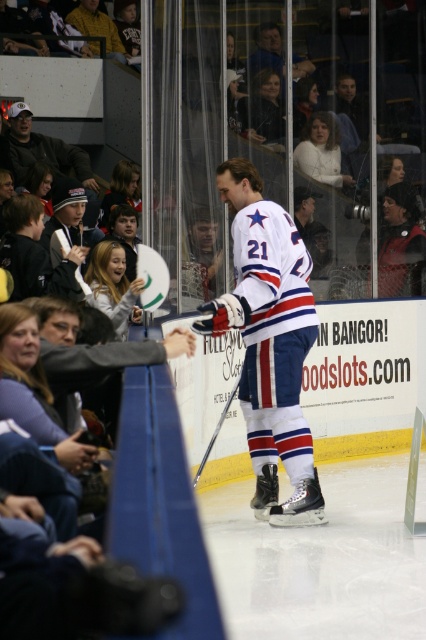
Question: Does white jersey at center appear over dark gray knit hat at upper left?

Choices:
 (A) no
 (B) yes

Answer: (A)

Question: Among these points, which one is farthest from the camera?

Choices:
 (A) (238, 205)
 (B) (86, 186)

Answer: (B)

Question: Which point is farther to the camera?

Choices:
 (A) (256, 241)
 (B) (83, 168)

Answer: (B)

Question: Can you confirm if white jersey at center is wider than dark gray knit hat at upper left?

Choices:
 (A) no
 (B) yes

Answer: (A)

Question: Does white jersey at center have a smaller size compared to dark gray knit hat at upper left?

Choices:
 (A) yes
 (B) no

Answer: (A)